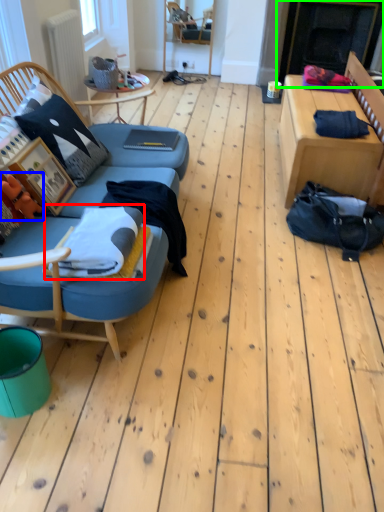
Question: Which object is positioned farthest from blanket (highlighted by a red box)? Select from toy (highlighted by a blue box) and fireplace (highlighted by a green box).

Choices:
 (A) toy
 (B) fireplace

Answer: (B)